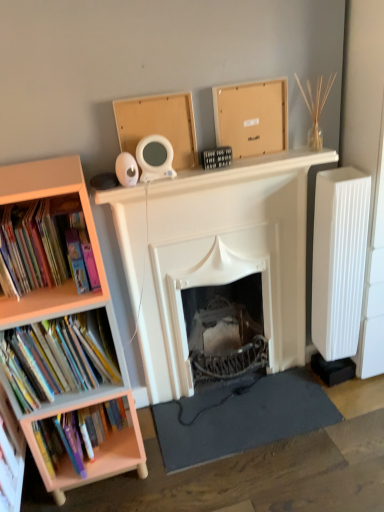
Locate an element on the screen. This screenshot has width=384, height=512. vacant space underneath dark gray rubber mat at lower center (from a real-world perspective) is located at coordinates (238, 422).